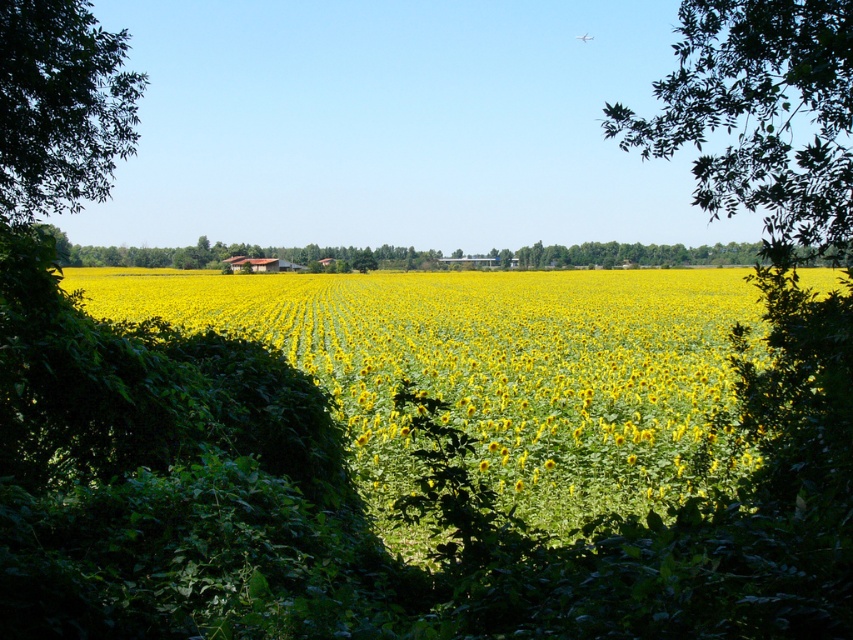
You are standing in the sunflower field and want to take a photo of the green leafy tree at upper right. If your camera has a maximum zoom range of 3 meters, will you be able to capture the tree clearly without moving closer?

The green leafy tree at upper right is 3.75 meters away from the viewer. Since the camera can only zoom up to 3 meters, it cannot capture the tree clearly without moving closer.

You are standing in the sunflower field and want to take a photo of the yellow matte sunflower at center without any obstructions. Since the green leafy tree at left is nearby, will the tree block the view of the sunflower?

The yellow matte sunflower at center is positioned under the green leafy tree at left, so the tree will block the view of the sunflower.